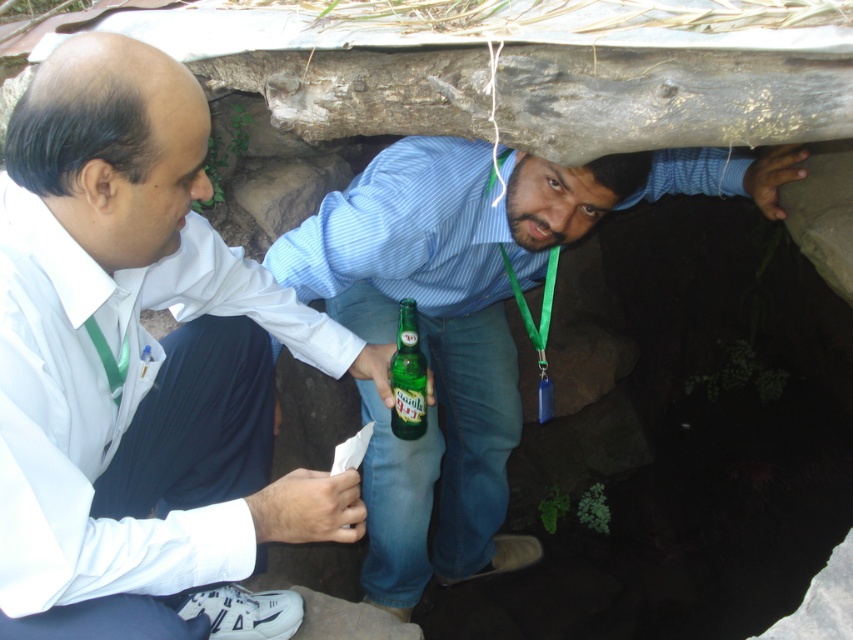
You are a photographer trying to capture a group photo of the white shirt at center and the green glass bottle at center. Since you want both subjects to be clearly visible, which one should you focus on first to ensure proper alignment?

The white shirt at center is positioned on the left side of green glass bottle at center, so you should focus on the white shirt at center first to ensure proper alignment.

You are a photographer trying to capture both the white shirt at center and the green glass bottle at center in a single frame. Based on their sizes, which object should you focus on to ensure both fit clearly in the photo?

The white shirt at center is larger than the green glass bottle at center, so focusing on the white shirt at center will help ensure both objects fit clearly in the photo.